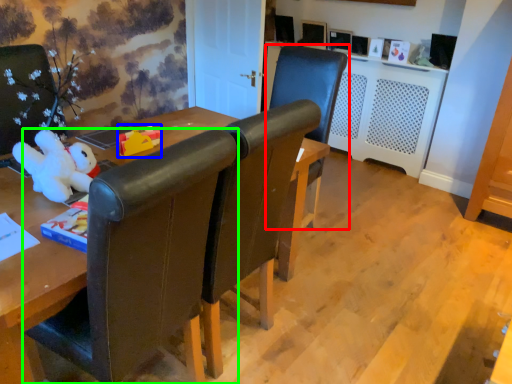
Question: Based on their relative distances, which object is nearer to chair (highlighted by a red box)? Choose from toy (highlighted by a blue box) and chair (highlighted by a green box).

Choices:
 (A) toy
 (B) chair

Answer: (A)